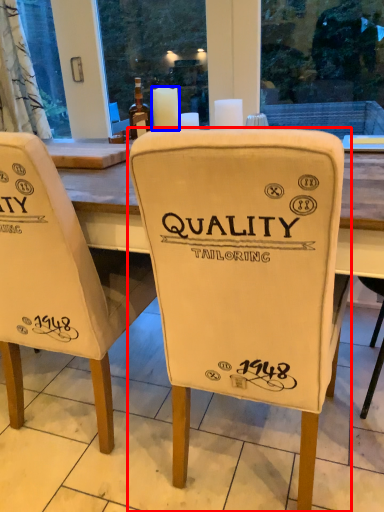
Question: Which object is closer to the camera taking this photo, chair (highlighted by a red box) or candle (highlighted by a blue box)?

Choices:
 (A) chair
 (B) candle

Answer: (A)